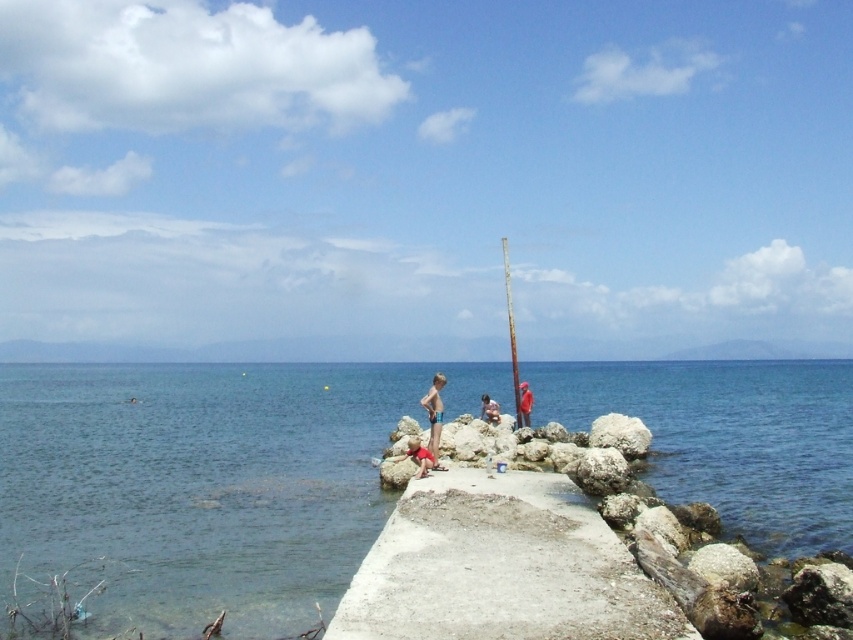
You are standing on the jetty and see the red fabric shorts at center and the smooth skin person at center. Which object is nearer to you?

The red fabric shorts at center is closer to the viewer than the smooth skin person at center.

You are a photographer trying to capture the smooth skin person at center and the red fabric shorts at center in a single shot. Since the camera can only focus on one subject at a time, which subject should you focus on to ensure the other is still in the background?

You should focus on the smooth skin person at center because the red fabric shorts at center is below them, so focusing on the person will keep the shorts in the background.

You are standing at the point with coordinates (206, 483) in the image. What do you see directly in front of you?

At point (206, 483) lies clear blue water at center.